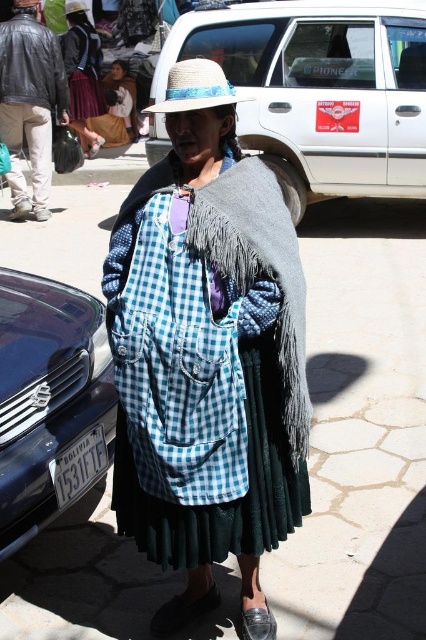
You are a delivery person who needs to deliver a package to the woman at the market. You see the white matte van at upper center and the straw hat at center. Which object is closer to you?

The white matte van at upper center is closer to you because the straw hat at center is behind it.

You are a delivery driver who needs to park your truck in this market area. You see the white matte van at upper center and the metallic blue car at lower left. Which vehicle is blocking your path to the parking spot?

The white matte van at upper center is blocking the path because it is positioned over the metallic blue car at lower left, which means it is in front of or above it, obstructing access.